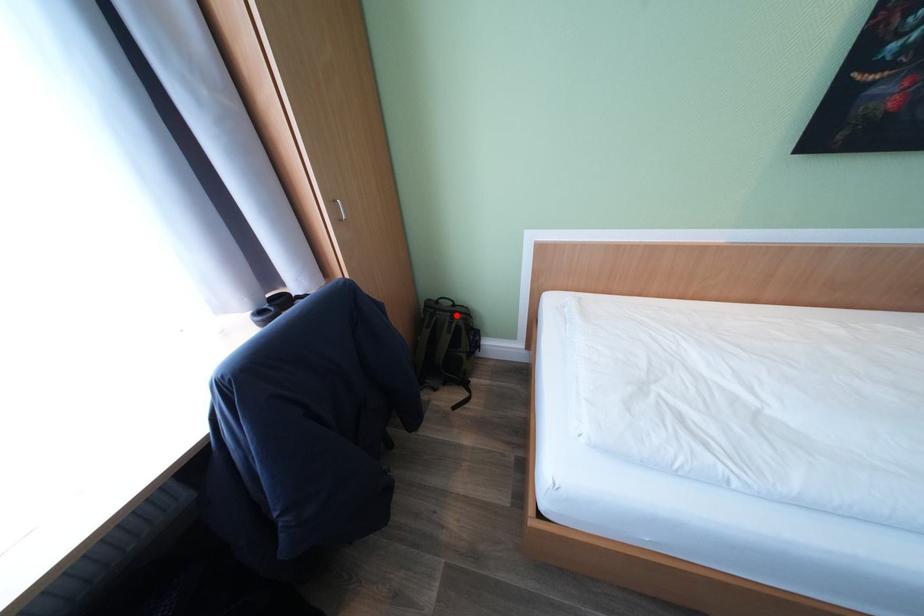
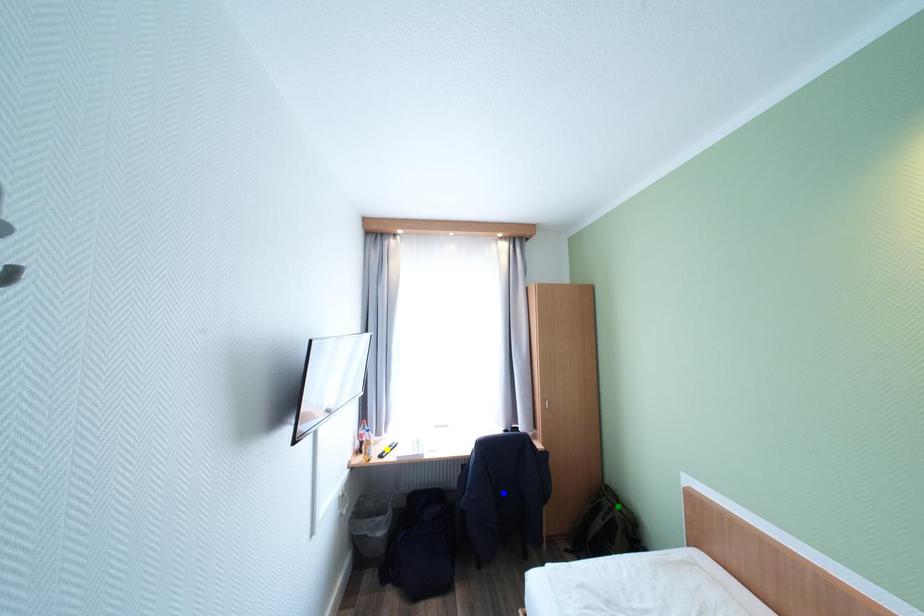
Question: I am providing you with two images of the same scene from different viewpoints. A red point is marked on the first image. You are given multiple points on the second image. Which spot in image 2 lines up with the point in image 1?

Choices:
 (A) blue point
 (B) yellow point
 (C) green point

Answer: (C)